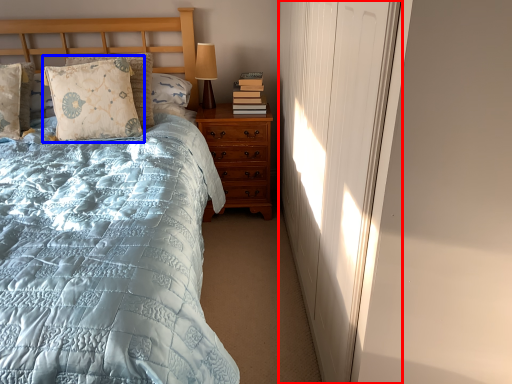
Question: Which point is closer to the camera, curtain (highlighted by a red box) or pillow (highlighted by a blue box)?

Choices:
 (A) curtain
 (B) pillow

Answer: (A)